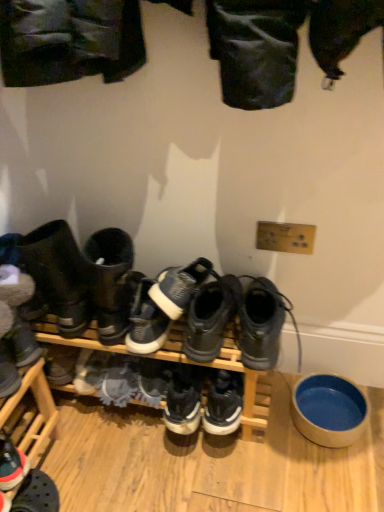
Question: Should I look upward or downward to see white suede sneaker at lower left, which is the 4th footwear from right to left?

Choices:
 (A) down
 (B) up

Answer: (A)

Question: From a real-world perspective, is reddish-brown leather sneaker at lower left, which is the 1th footwear in left-to-right order, below blue ceramic bowl at lower right?

Choices:
 (A) no
 (B) yes

Answer: (A)

Question: From the image's perspective, is reddish-brown leather sneaker at lower left, which is the 1th footwear in left-to-right order, on top of blue ceramic bowl at lower right?

Choices:
 (A) no
 (B) yes

Answer: (A)

Question: Is reddish-brown leather sneaker at lower left, which is the 1th footwear in left-to-right order, in contact with blue ceramic bowl at lower right?

Choices:
 (A) yes
 (B) no

Answer: (B)

Question: Can you confirm if reddish-brown leather sneaker at lower left, marked as the sixth footwear in a right-to-left arrangement, is shorter than blue ceramic bowl at lower right?

Choices:
 (A) no
 (B) yes

Answer: (A)

Question: Considering the relative sizes of reddish-brown leather sneaker at lower left, which is the 1th footwear in left-to-right order, and blue ceramic bowl at lower right in the image provided, is reddish-brown leather sneaker at lower left, which is the 1th footwear in left-to-right order, wider than blue ceramic bowl at lower right?

Choices:
 (A) yes
 (B) no

Answer: (A)

Question: Is reddish-brown leather sneaker at lower left, marked as the sixth footwear in a right-to-left arrangement, in front of blue ceramic bowl at lower right?

Choices:
 (A) no
 (B) yes

Answer: (B)

Question: From the image's perspective, is black mesh sneakers at center, the 2th footwear from the right, located beneath white suede sneaker at lower left, which appears as the third footwear when viewed from the left?

Choices:
 (A) no
 (B) yes

Answer: (A)

Question: Is black mesh sneakers at center, the 2th footwear from the right, positioned far away from white suede sneaker at lower left, which appears as the third footwear when viewed from the left?

Choices:
 (A) yes
 (B) no

Answer: (B)

Question: Is the position of black mesh sneakers at center, the 2th footwear from the right, less distant than that of white suede sneaker at lower left, which is the 4th footwear from right to left?

Choices:
 (A) no
 (B) yes

Answer: (B)

Question: Is white suede sneaker at lower left, which is the 4th footwear from right to left, at the back of black mesh sneakers at center, acting as the 5th footwear starting from the left?

Choices:
 (A) yes
 (B) no

Answer: (B)

Question: Is black mesh sneakers at center, acting as the 5th footwear starting from the left, not within white suede sneaker at lower left, which is the 4th footwear from right to left?

Choices:
 (A) yes
 (B) no

Answer: (A)

Question: Considering the relative sizes of black mesh sneakers at center, the 2th footwear from the right, and white suede sneaker at lower left, which is the 4th footwear from right to left, in the image provided, is black mesh sneakers at center, the 2th footwear from the right, shorter than white suede sneaker at lower left, which is the 4th footwear from right to left,?

Choices:
 (A) no
 (B) yes

Answer: (A)

Question: Does white suede sneaker at lower left, which is the 4th footwear from right to left, appear on the left side of leather boots at left, which appears as the fifth footwear when viewed from the right?

Choices:
 (A) yes
 (B) no

Answer: (B)